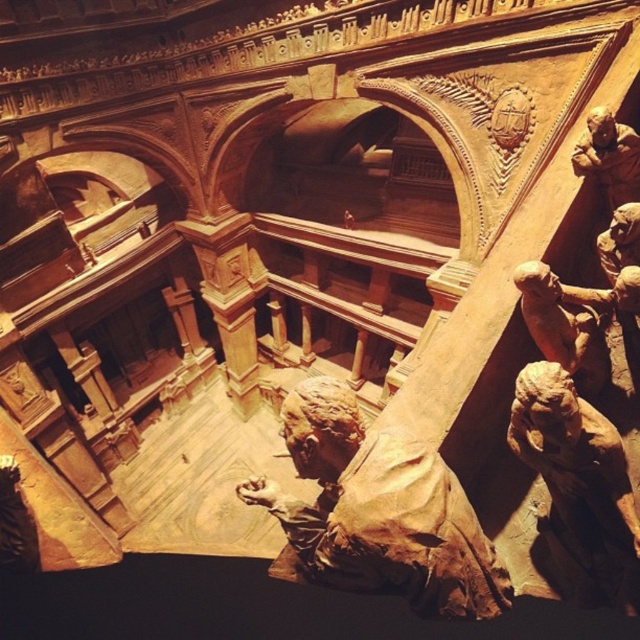
Question: Can you confirm if brown clay figure at center is bigger than brown clay figure at upper right?

Choices:
 (A) no
 (B) yes

Answer: (B)

Question: Which object is the closest to the brown clay figure at center?

Choices:
 (A) brown clay figure at upper right
 (B) matte brown statue at lower right

Answer: (B)

Question: Can you confirm if brown clay figure at center is positioned above matte brown statue at lower right?

Choices:
 (A) yes
 (B) no

Answer: (B)

Question: Which point is farther to the camera?

Choices:
 (A) (561, 541)
 (B) (403, 509)

Answer: (A)

Question: Which object is farther from the camera taking this photo?

Choices:
 (A) matte brown statue at lower right
 (B) brown clay figure at upper right
 (C) brown clay figure at center

Answer: (B)

Question: Is brown clay figure at center bigger than brown clay figure at upper right?

Choices:
 (A) no
 (B) yes

Answer: (B)